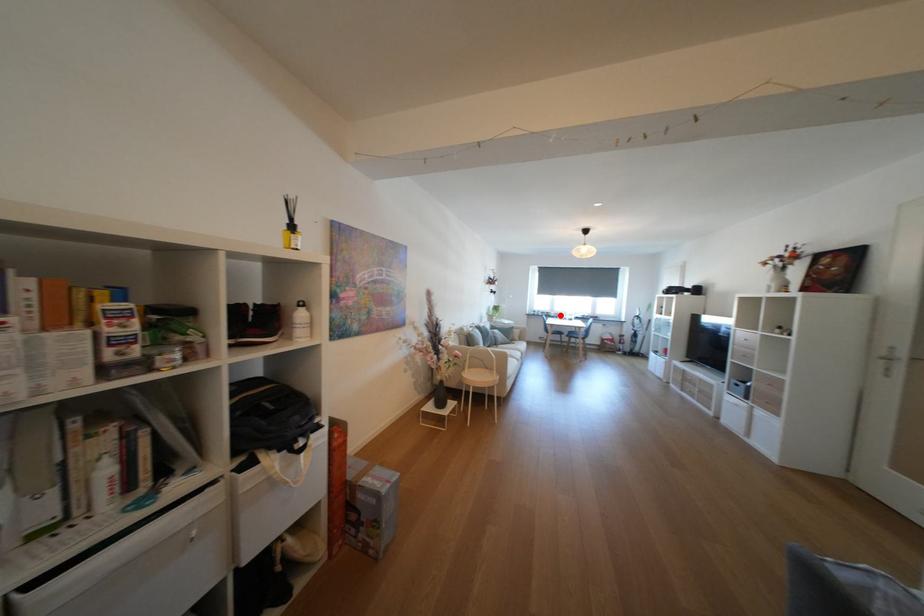
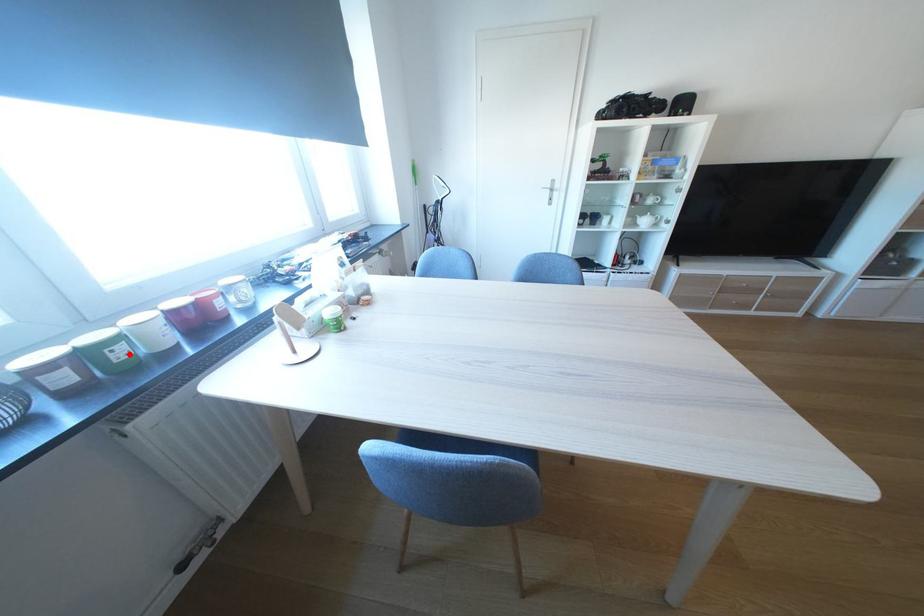
I am providing you with two images of the same scene from different viewpoints. A red point is marked on the first image and another point is marked on the second image. Are the points marked in image1 and image2 representing the same 3D position?

Yes